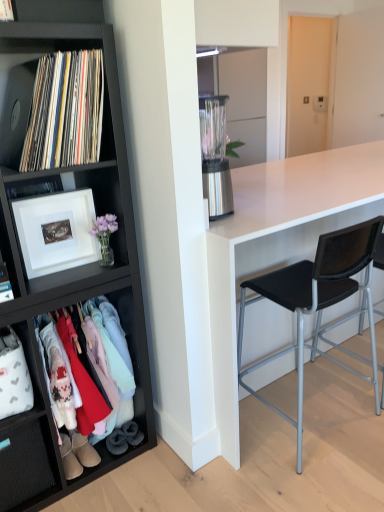
Image resolution: width=384 pixels, height=512 pixels. In order to click on vacant region to the right of light brown suede boot at lower left, which ranks as the first footwear in right-to-left order in this screenshot , I will do `click(120, 463)`.